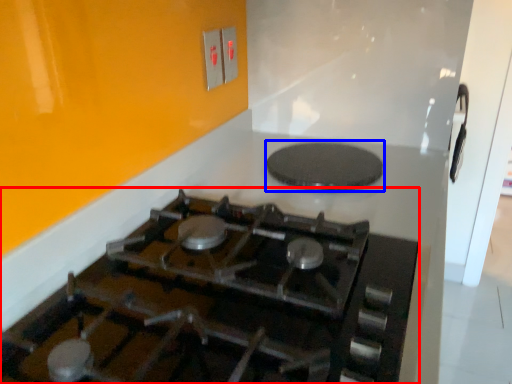
Question: Which of the following is the closest to the observer, gas stove (highlighted by a red box) or pizza pan (highlighted by a blue box)?

Choices:
 (A) gas stove
 (B) pizza pan

Answer: (A)